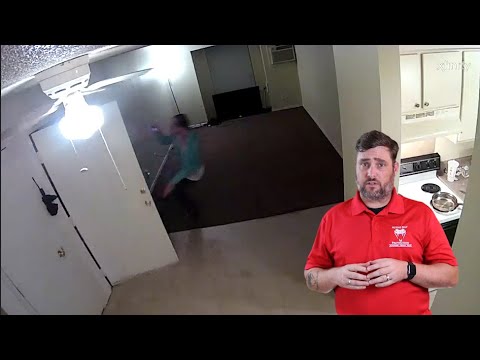
Image resolution: width=480 pixels, height=360 pixels. What are the coordinates of `white door` in the screenshot? It's located at (108, 186).